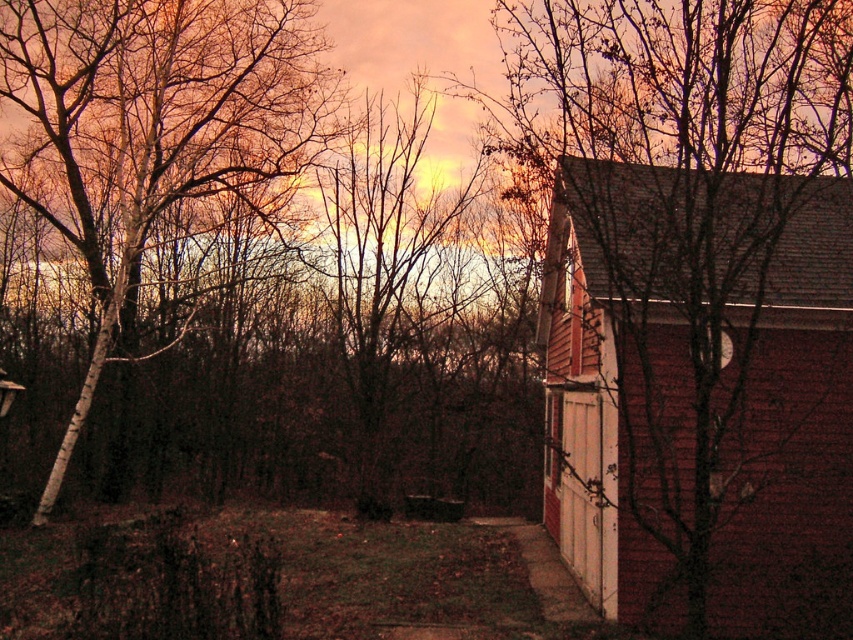
Is point (686, 531) positioned after point (177, 157)?

No, (686, 531) is closer to viewer.

Who is more forward, [805,509] or [268,92]?

Point [805,509] is more forward.

This screenshot has width=853, height=640. What are the coordinates of `brick siding house at right` in the screenshot? It's located at (700, 392).